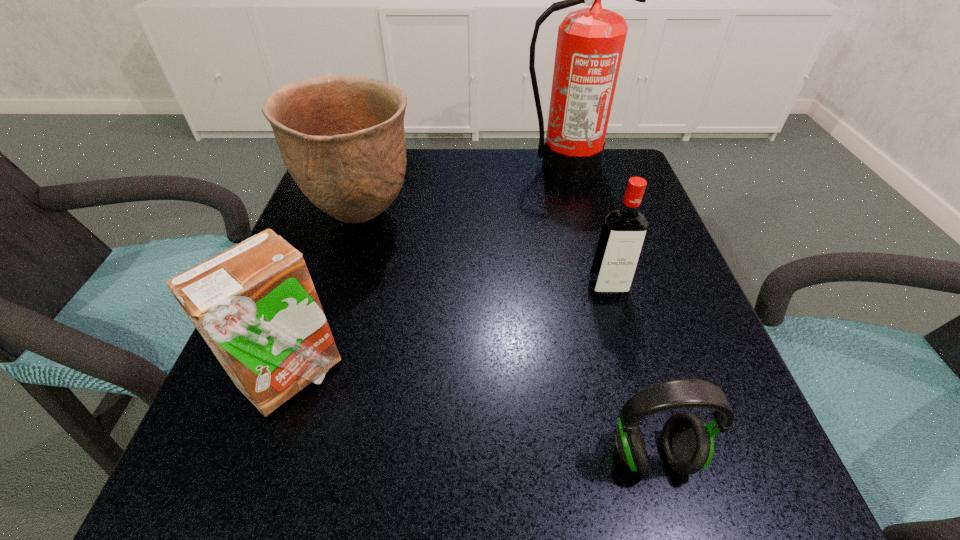
The width and height of the screenshot is (960, 540). Find the location of `vacant space that is in between the vodka and the second farthest object`. vacant space that is in between the vodka and the second farthest object is located at coordinates (485, 253).

Locate an element on the screen. The image size is (960, 540). free space between the third nearest object and the shortest object is located at coordinates (630, 372).

At what (x,y) coordinates should I click in order to perform the action: click on free area in between the third farthest object and the second nearest object. Please return your answer as a coordinate pair (x, y). The height and width of the screenshot is (540, 960). Looking at the image, I should click on (449, 332).

The image size is (960, 540). Find the location of `free space between the fourth nearest object and the carton`. free space between the fourth nearest object and the carton is located at coordinates (326, 297).

Find the location of `free space between the headset and the fourth nearest object`. free space between the headset and the fourth nearest object is located at coordinates (508, 336).

This screenshot has height=540, width=960. I want to click on unoccupied area between the farthest object and the vodka, so click(x=587, y=227).

I want to click on the fourth closest object to the carton, so click(590, 42).

Identify which object is located as the third nearest to the third nearest object. Please provide its 2D coordinates. Your answer should be formatted as a tuple, i.e. [(x, y)], where the tuple contains the x and y coordinates of a point satisfying the conditions above.

[(342, 139)]

Locate an element on the screen. This screenshot has height=540, width=960. free space in the image that satisfies the following two spatial constraints: 1. on the front side of the fire extinguisher; 2. on the straw side of the carton is located at coordinates (619, 376).